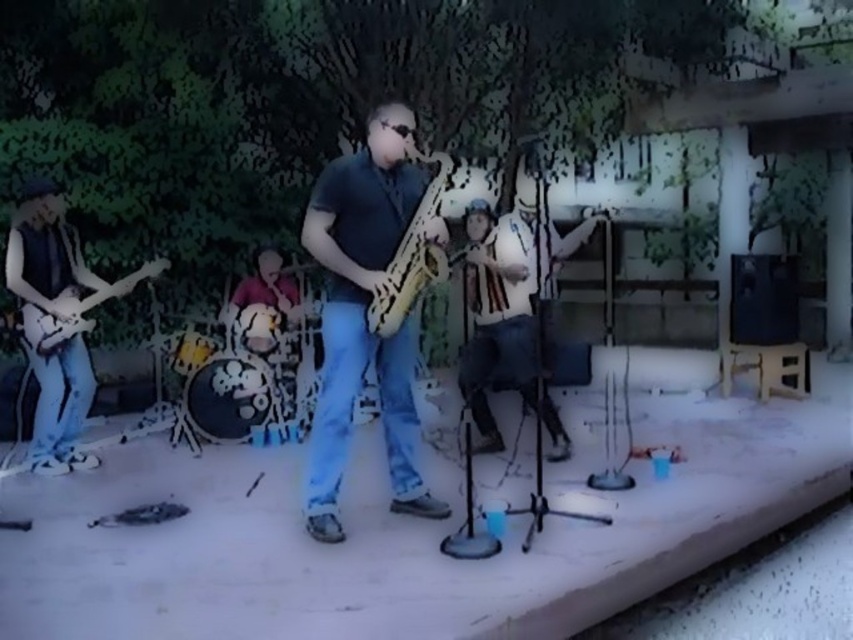
Looking at this image, how much distance is there between matte yellow saxophone at center and wooden saxophone at center?

9.85 inches

Can you confirm if matte yellow saxophone at center is shorter than wooden saxophone at center?

Incorrect, matte yellow saxophone at center's height does not fall short of wooden saxophone at center's.

Locate an element on the screen. This screenshot has width=853, height=640. matte yellow saxophone at center is located at coordinates (364, 314).

Describe the element at coordinates (415, 257) in the screenshot. I see `wooden saxophone at center` at that location.

Based on the photo, can you confirm if wooden saxophone at center is positioned above matte black electric guitar at left?

Indeed, wooden saxophone at center is positioned over matte black electric guitar at left.

Which is in front, point (397, 285) or point (61, 310)?

Point (397, 285) is in front.

In order to click on wooden saxophone at center in this screenshot , I will do `click(415, 257)`.

Can you confirm if matte yellow saxophone at center is smaller than matte black electric guitar at left?

Actually, matte yellow saxophone at center might be larger than matte black electric guitar at left.

Is matte yellow saxophone at center above matte black electric guitar at left?

No, matte yellow saxophone at center is not above matte black electric guitar at left.

Who is more forward, (322, 252) or (50, 301)?

Point (322, 252) is in front.

Locate an element on the screen. matte yellow saxophone at center is located at coordinates (364, 314).